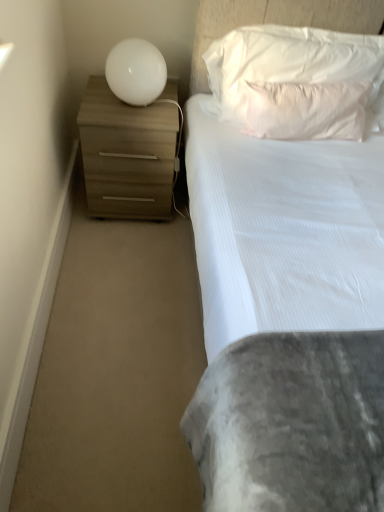
Identify the location of white soft pillow at upper center, placed as the 2th pillow when sorted from bottom to top. pos(286,63).

In order to click on white glossy sphere at upper left in this screenshot , I will do `click(136, 72)`.

What do you see at coordinates (306, 110) in the screenshot?
I see `white textured pillow at upper center, the 1th pillow positioned from the bottom` at bounding box center [306, 110].

This screenshot has width=384, height=512. Describe the element at coordinates (127, 154) in the screenshot. I see `matte wood chest of drawers at left` at that location.

What are the coordinates of `white soft pillow at upper center, placed as the 2th pillow when sorted from bottom to top` in the screenshot? It's located at (286, 63).

Considering the relative positions of white soft pillow at upper center, the first pillow in the top-to-bottom sequence, and white glossy sphere at upper left in the image provided, is white soft pillow at upper center, the first pillow in the top-to-bottom sequence, behind white glossy sphere at upper left?

No, white soft pillow at upper center, the first pillow in the top-to-bottom sequence, is in front of white glossy sphere at upper left.

Is white glossy sphere at upper left at the back of white soft pillow at upper center, placed as the 2th pillow when sorted from bottom to top?

No, white soft pillow at upper center, placed as the 2th pillow when sorted from bottom to top, is not facing away from white glossy sphere at upper left.

From the image's perspective, which is below, white soft pillow at upper center, placed as the 2th pillow when sorted from bottom to top, or white glossy sphere at upper left?

white glossy sphere at upper left is shown below in the image.

Is white textured pillow at upper center, the 2th pillow viewed from the top, at the back of white soft pillow at upper center, placed as the 2th pillow when sorted from bottom to top?

Yes.

Is white soft pillow at upper center, placed as the 2th pillow when sorted from bottom to top, wider or thinner than white textured pillow at upper center, the 2th pillow viewed from the top?

In the image, white soft pillow at upper center, placed as the 2th pillow when sorted from bottom to top, appears to be wider than white textured pillow at upper center, the 2th pillow viewed from the top.

Considering the relative sizes of white soft pillow at upper center, placed as the 2th pillow when sorted from bottom to top, and white textured pillow at upper center, the 2th pillow viewed from the top, in the image provided, is white soft pillow at upper center, placed as the 2th pillow when sorted from bottom to top, taller than white textured pillow at upper center, the 2th pillow viewed from the top,?

Yes.

Consider the image. Is matte wood chest of drawers at left in front of white glossy sphere at upper left?

No, matte wood chest of drawers at left is further to the viewer.

Locate an element on the screen. The height and width of the screenshot is (512, 384). lamp above the matte wood chest of drawers at left (from the image's perspective) is located at coordinates (136, 72).

Which object is positioned more to the left, matte wood chest of drawers at left or white glossy sphere at upper left?

From the viewer's perspective, matte wood chest of drawers at left appears more on the left side.

Is matte wood chest of drawers at left looking in the opposite direction of white glossy sphere at upper left?

That's not correct — matte wood chest of drawers at left is not looking away from white glossy sphere at upper left.

Is point (119, 64) closer or farther from the camera than point (279, 100)?

Point (119, 64) is positioned farther from the camera compared to point (279, 100).

Would you say white glossy sphere at upper left is to the left or to the right of white textured pillow at upper center, the 1th pillow positioned from the bottom, in the picture?

white glossy sphere at upper left is positioned on white textured pillow at upper center, the 1th pillow positioned from the bottom,'s left side.

Is white glossy sphere at upper left positioned beyond the bounds of white textured pillow at upper center, the 2th pillow viewed from the top?

Yes, white glossy sphere at upper left is not within white textured pillow at upper center, the 2th pillow viewed from the top.

Is there a large distance between white glossy sphere at upper left and white textured pillow at upper center, the 1th pillow positioned from the bottom?

No.

In the scene shown: Does white glossy sphere at upper left have a lesser width compared to matte wood chest of drawers at left?

Indeed, white glossy sphere at upper left has a lesser width compared to matte wood chest of drawers at left.

Is matte wood chest of drawers at left at the back of white glossy sphere at upper left?

white glossy sphere at upper left does not have its back to matte wood chest of drawers at left.

In the scene shown: Which is more to the left, white glossy sphere at upper left or matte wood chest of drawers at left?

From the viewer's perspective, matte wood chest of drawers at left appears more on the left side.

Is white textured pillow at upper center, the 2th pillow viewed from the top, spatially inside white soft pillow at upper center, placed as the 2th pillow when sorted from bottom to top, or outside of it?

white textured pillow at upper center, the 2th pillow viewed from the top, exists entirely within white soft pillow at upper center, placed as the 2th pillow when sorted from bottom to top.

Is point (360, 92) positioned in front of point (318, 29)?

Yes.

How far apart are white textured pillow at upper center, the 2th pillow viewed from the top, and white soft pillow at upper center, placed as the 2th pillow when sorted from bottom to top?

The distance of white textured pillow at upper center, the 2th pillow viewed from the top, from white soft pillow at upper center, placed as the 2th pillow when sorted from bottom to top, is 5.64 inches.

Which object is further away from the camera, white textured pillow at upper center, the 2th pillow viewed from the top, or white soft pillow at upper center, placed as the 2th pillow when sorted from bottom to top?

white textured pillow at upper center, the 2th pillow viewed from the top.

Between point (173, 112) and point (348, 45), which one is positioned in front?

The point (348, 45) is in front.

How distant is matte wood chest of drawers at left from white soft pillow at upper center, placed as the 2th pillow when sorted from bottom to top?

A distance of 45.50 centimeters exists between matte wood chest of drawers at left and white soft pillow at upper center, placed as the 2th pillow when sorted from bottom to top.

Is matte wood chest of drawers at left to the right of white soft pillow at upper center, the first pillow in the top-to-bottom sequence, from the viewer's perspective?

Incorrect, matte wood chest of drawers at left is not on the right side of white soft pillow at upper center, the first pillow in the top-to-bottom sequence.

Is matte wood chest of drawers at left turned away from white soft pillow at upper center, the first pillow in the top-to-bottom sequence?

No, matte wood chest of drawers at left is not facing away from white soft pillow at upper center, the first pillow in the top-to-bottom sequence.

This screenshot has width=384, height=512. In order to click on lamp located below the white soft pillow at upper center, placed as the 2th pillow when sorted from bottom to top (from the image's perspective) in this screenshot , I will do `click(136, 72)`.

Identify the location of pillow above the white textured pillow at upper center, the 1th pillow positioned from the bottom (from a real-world perspective). (286, 63).

Consider the image. Based on their spatial positions, is matte wood chest of drawers at left or white soft pillow at upper center, placed as the 2th pillow when sorted from bottom to top, closer to white textured pillow at upper center, the 2th pillow viewed from the top?

Among the two, white soft pillow at upper center, placed as the 2th pillow when sorted from bottom to top, is located nearer to white textured pillow at upper center, the 2th pillow viewed from the top.

Estimate the real-world distances between objects in this image. Which object is further from white soft pillow at upper center, placed as the 2th pillow when sorted from bottom to top, white glossy sphere at upper left or matte wood chest of drawers at left?

matte wood chest of drawers at left.

Based on their spatial positions, is matte wood chest of drawers at left or white glossy sphere at upper left closer to white soft pillow at upper center, placed as the 2th pillow when sorted from bottom to top?

Based on the image, white glossy sphere at upper left appears to be nearer to white soft pillow at upper center, placed as the 2th pillow when sorted from bottom to top.

Based on their spatial positions, is white glossy sphere at upper left or white textured pillow at upper center, the 2th pillow viewed from the top, closer to matte wood chest of drawers at left?

white glossy sphere at upper left is positioned closer to the anchor matte wood chest of drawers at left.

Considering their positions, is white glossy sphere at upper left positioned further to matte wood chest of drawers at left than white soft pillow at upper center, the first pillow in the top-to-bottom sequence?

→ Among the two, white soft pillow at upper center, the first pillow in the top-to-bottom sequence, is located further to matte wood chest of drawers at left.

Which object lies nearer to the anchor point white soft pillow at upper center, placed as the 2th pillow when sorted from bottom to top, white textured pillow at upper center, the 2th pillow viewed from the top, or white glossy sphere at upper left?

The object closer to white soft pillow at upper center, placed as the 2th pillow when sorted from bottom to top, is white textured pillow at upper center, the 2th pillow viewed from the top.

Based on their spatial positions, is white glossy sphere at upper left or white soft pillow at upper center, placed as the 2th pillow when sorted from bottom to top, further from white textured pillow at upper center, the 2th pillow viewed from the top?

white glossy sphere at upper left is positioned further to the anchor white textured pillow at upper center, the 2th pillow viewed from the top.

Looking at the image, which one is located closer to white glossy sphere at upper left, matte wood chest of drawers at left or white soft pillow at upper center, placed as the 2th pillow when sorted from bottom to top?

The object closer to white glossy sphere at upper left is matte wood chest of drawers at left.

This screenshot has width=384, height=512. Find the location of `pillow between white glossy sphere at upper left and white textured pillow at upper center, the 1th pillow positioned from the bottom`. pillow between white glossy sphere at upper left and white textured pillow at upper center, the 1th pillow positioned from the bottom is located at coordinates (286, 63).

Image resolution: width=384 pixels, height=512 pixels. I want to click on pillow between matte wood chest of drawers at left and white textured pillow at upper center, the 2th pillow viewed from the top, from left to right, so click(286, 63).

The height and width of the screenshot is (512, 384). In order to click on lamp between matte wood chest of drawers at left and white soft pillow at upper center, placed as the 2th pillow when sorted from bottom to top in this screenshot , I will do `click(136, 72)`.

The image size is (384, 512). I want to click on lamp between matte wood chest of drawers at left and white textured pillow at upper center, the 1th pillow positioned from the bottom, in the horizontal direction, so click(136, 72).